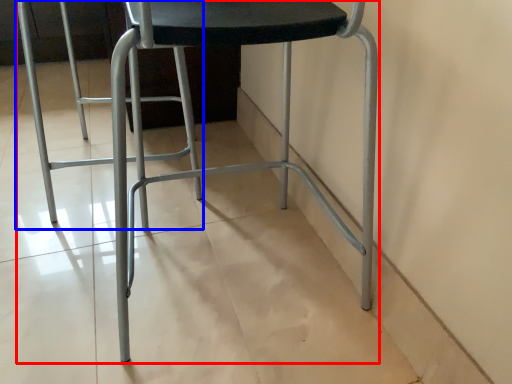
Question: Among these objects, which one is nearest to the camera, chair (highlighted by a red box) or swivel chair (highlighted by a blue box)?

Choices:
 (A) chair
 (B) swivel chair

Answer: (A)